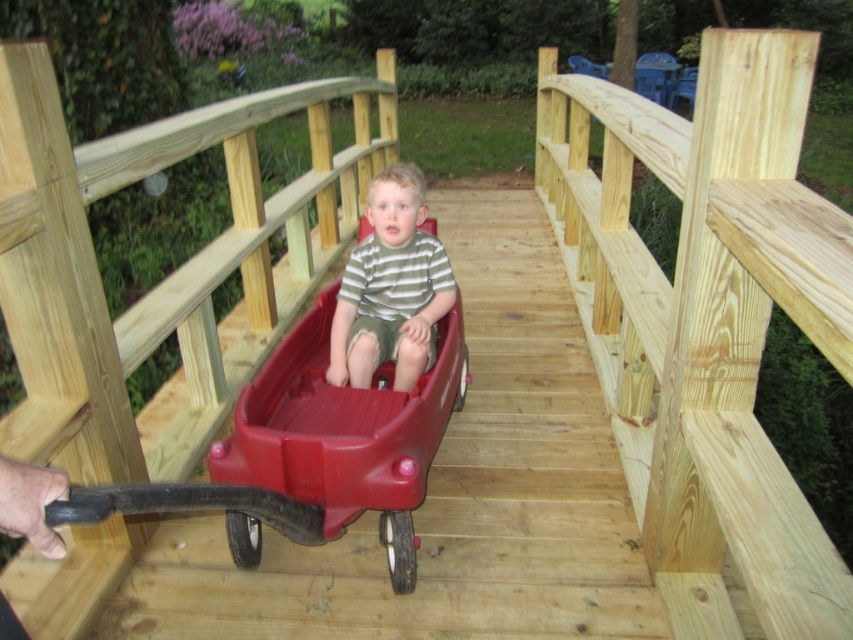
In the scene shown: You are a painter who needs to paint both the natural wood rail at center and the striped cotton shirt at center. If you have enough paint to cover 10 square inches, which object requires more paint based on their widths?

The natural wood rail at center requires more paint because its width is greater than the striped cotton shirt at center.

You are a parent watching your child. The child is sitting in the rubberized plastic wagon at center wearing the striped cotton shirt at center. You want to ensure the shirt stays clean. Which object should you focus on keeping the shirt away from to prevent dirt from the bridge?

The rubberized plastic wagon at center is in front of the striped cotton shirt at center. To prevent dirt from the bridge, focus on keeping the striped cotton shirt at center away from the wagon since it is closer to the bridge surface.